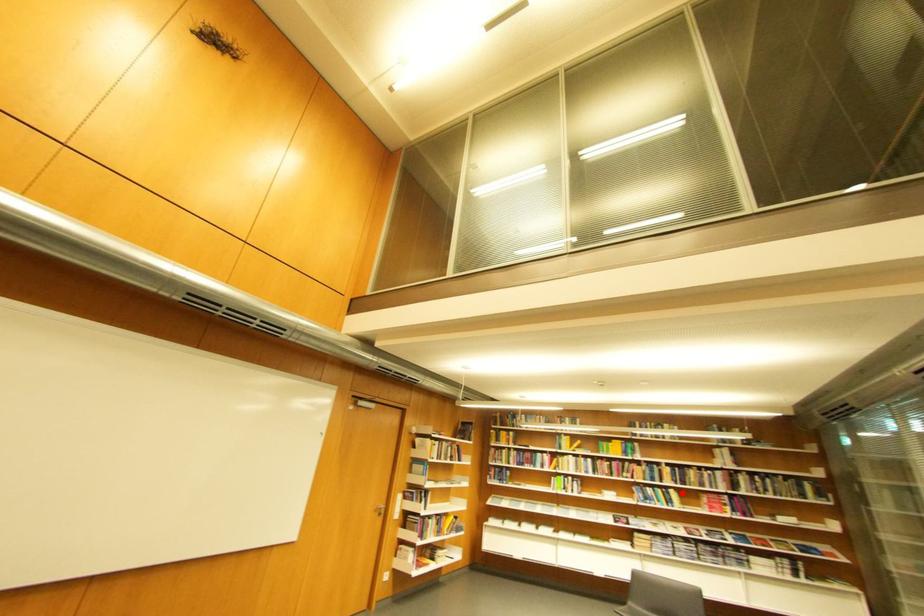
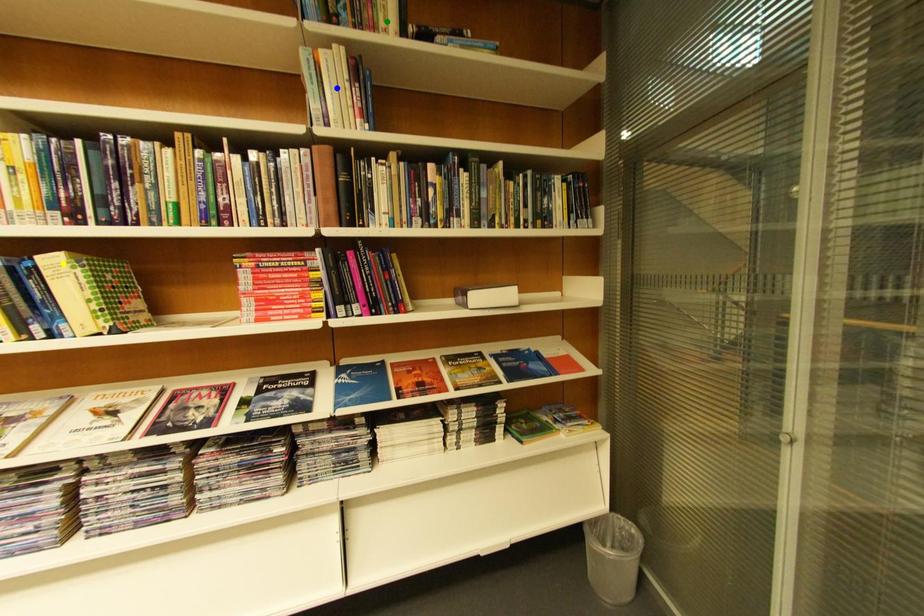
Question: I am providing you with two images of the same scene from different viewpoints. A red point is marked on the first image. You are given multiple points on the second image. Which point in image 2 is actually the same real-world point as the red point in image 1?

Choices:
 (A) yellow point
 (B) green point
 (C) blue point

Answer: (A)